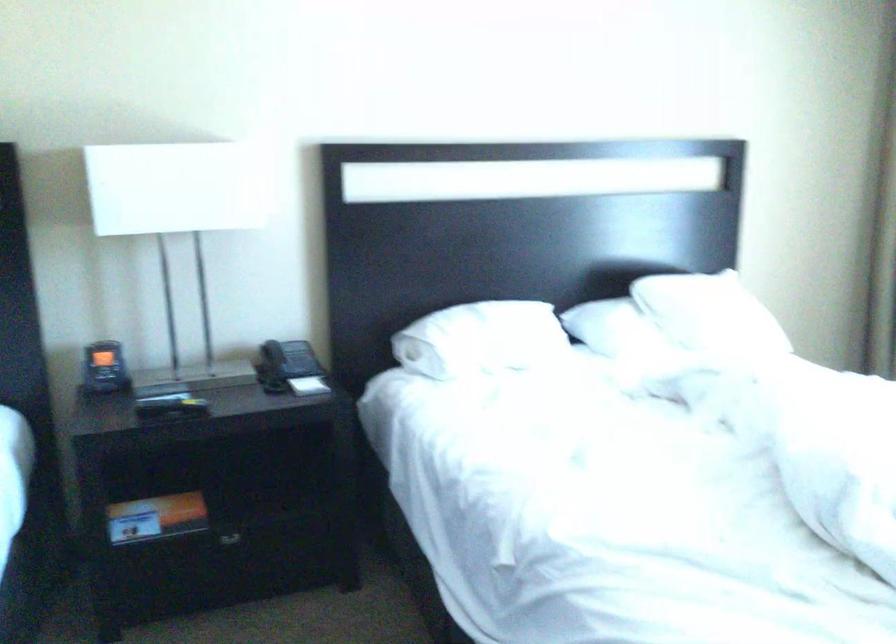
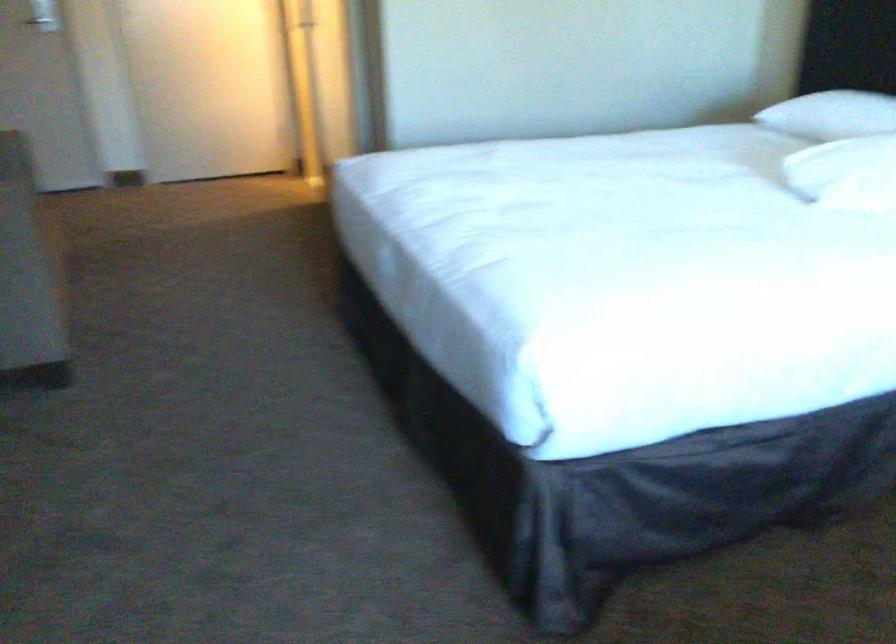
The images are taken continuously from a first-person perspective. In which direction is your viewpoint rotating?

The camera's rotation is toward left-down.